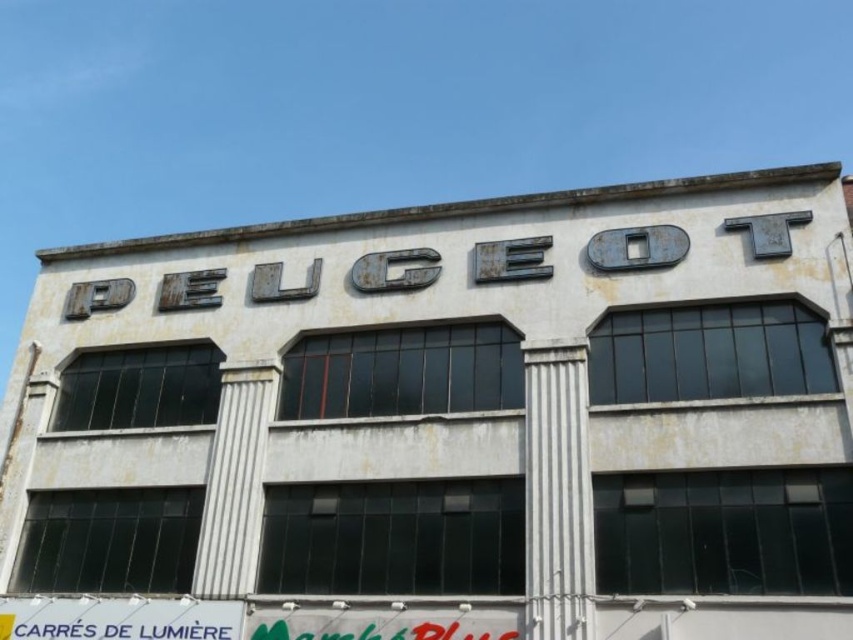
Question: Which point is farther to the camera?

Choices:
 (A) 556,483
 (B) 21,605

Answer: (B)

Question: Is white faded sign at center behind white plastic sign at lower left?

Choices:
 (A) no
 (B) yes

Answer: (A)

Question: Where is white faded sign at center located in relation to white plastic sign at lower left in the image?

Choices:
 (A) left
 (B) right

Answer: (B)

Question: Is white faded sign at center positioned before white plastic sign at lower left?

Choices:
 (A) no
 (B) yes

Answer: (B)

Question: Which point appears farthest from the camera in this image?

Choices:
 (A) (235, 400)
 (B) (151, 618)

Answer: (A)

Question: Which object appears closest to the camera in this image?

Choices:
 (A) white faded sign at center
 (B) white plastic sign at lower left

Answer: (A)